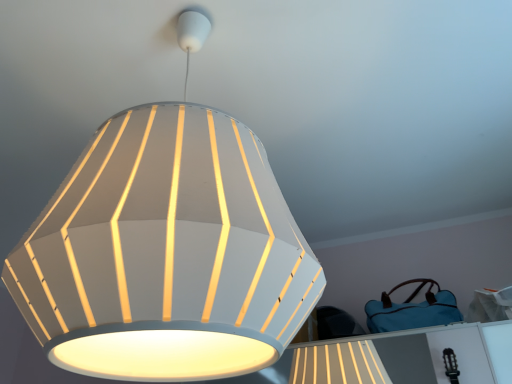
At what (x,y) coordinates should I click in order to perform the action: click on white matte lampshade at upper center. Please return your answer as a coordinate pair (x, y). This screenshot has height=384, width=512. Looking at the image, I should click on (166, 253).

The width and height of the screenshot is (512, 384). Describe the element at coordinates (166, 253) in the screenshot. I see `white matte lampshade at upper center` at that location.

You are a GUI agent. You are given a task and a screenshot of the screen. Output one action in this format:
    pyautogui.click(x=<x>, y=<y>)
    Task: Click on the white matte lampshade at upper center
    The image size is (512, 384).
    Given the screenshot: What is the action you would take?
    pyautogui.click(x=166, y=253)